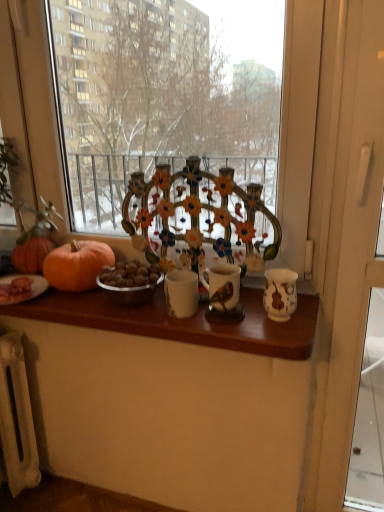
Question: From a real-world perspective, does wooden table at center sit lower than orange matte pumpkin at left?

Choices:
 (A) no
 (B) yes

Answer: (B)

Question: Is wooden table at center shorter than orange matte pumpkin at left?

Choices:
 (A) no
 (B) yes

Answer: (B)

Question: Does wooden table at center contain orange matte pumpkin at left?

Choices:
 (A) no
 (B) yes

Answer: (A)

Question: Can you confirm if wooden table at center is smaller than orange matte pumpkin at left?

Choices:
 (A) no
 (B) yes

Answer: (A)

Question: Is wooden table at center next to orange matte pumpkin at left and touching it?

Choices:
 (A) yes
 (B) no

Answer: (B)

Question: Is point (51, 273) closer or farther from the camera than point (352, 73)?

Choices:
 (A) farther
 (B) closer

Answer: (A)

Question: Looking at their shapes, would you say orange matte pumpkin at left is wider or thinner than white plastic screen door at right?

Choices:
 (A) wide
 (B) thin

Answer: (A)

Question: In the image, is orange matte pumpkin at left positioned in front of or behind white plastic screen door at right?

Choices:
 (A) front
 (B) behind

Answer: (B)

Question: From a real-world perspective, is orange matte pumpkin at left above or below white plastic screen door at right?

Choices:
 (A) above
 (B) below

Answer: (A)

Question: From their relative heights in the image, would you say white plastic screen door at right is taller or shorter than orange matte pumpkin at left?

Choices:
 (A) tall
 (B) short

Answer: (A)

Question: From a real-world perspective, relative to orange matte pumpkin at left, is white plastic screen door at right vertically above or below?

Choices:
 (A) below
 (B) above

Answer: (A)

Question: Which is correct: white plastic screen door at right is inside orange matte pumpkin at left, or outside of it?

Choices:
 (A) outside
 (B) inside

Answer: (A)

Question: From the image's perspective, is white plastic screen door at right positioned above or below orange matte pumpkin at left?

Choices:
 (A) above
 (B) below

Answer: (B)

Question: Looking at their shapes, would you say orange matte pumpkin at left is wider or thinner than matte ceramic candle holder at center?

Choices:
 (A) wide
 (B) thin

Answer: (A)

Question: Considering the relative positions of orange matte pumpkin at left and matte ceramic candle holder at center in the image provided, is orange matte pumpkin at left to the left or to the right of matte ceramic candle holder at center?

Choices:
 (A) left
 (B) right

Answer: (A)